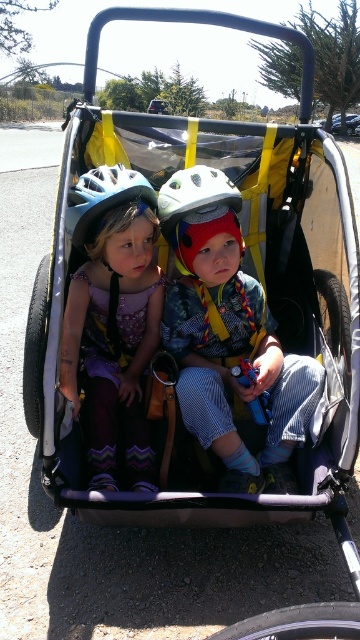
Question: Estimate the real-world distances between objects in this image. Which object is closer to the matte white helmet at center?

Choices:
 (A) white matte helmet at center
 (B) matte blue helmet at center
 (C) blue plastic toy at center

Answer: (A)

Question: Is matte white helmet at center below blue plastic toy at center?

Choices:
 (A) no
 (B) yes

Answer: (A)

Question: Which object appears farthest from the camera in this image?

Choices:
 (A) matte white helmet at center
 (B) matte blue helmet at center

Answer: (B)

Question: Does matte purple dress at center have a greater width compared to blue plastic toy at center?

Choices:
 (A) no
 (B) yes

Answer: (B)

Question: Can you confirm if white matte helmet at center is positioned to the right of blue plastic toy at center?

Choices:
 (A) yes
 (B) no

Answer: (B)

Question: Which point is closer to the camera?

Choices:
 (A) matte white helmet at center
 (B) white matte helmet at center
 (C) matte blue helmet at center
 (D) matte purple dress at center

Answer: (A)